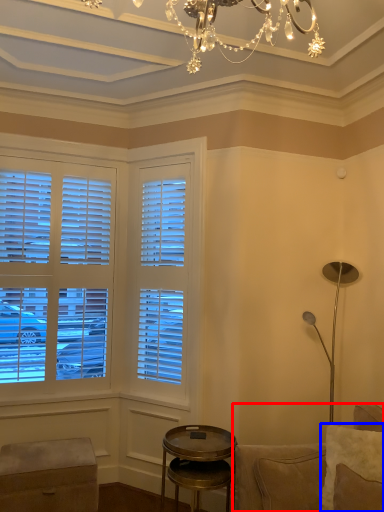
Question: Which object appears closest to the camera in this image, studio couch (highlighted by a red box) or pillow (highlighted by a blue box)?

Choices:
 (A) studio couch
 (B) pillow

Answer: (A)